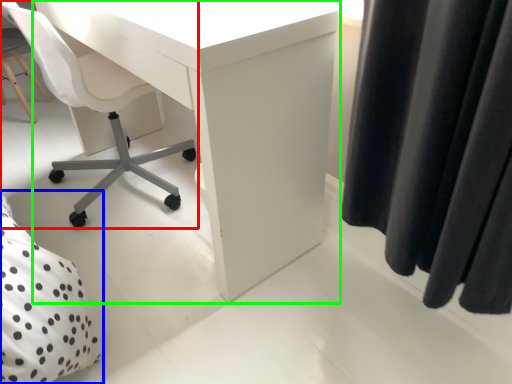
Question: Based on their relative distances, which object is nearer to chair (highlighted by a red box)? Choose from bed (highlighted by a blue box) and desk (highlighted by a green box).

Choices:
 (A) bed
 (B) desk

Answer: (B)